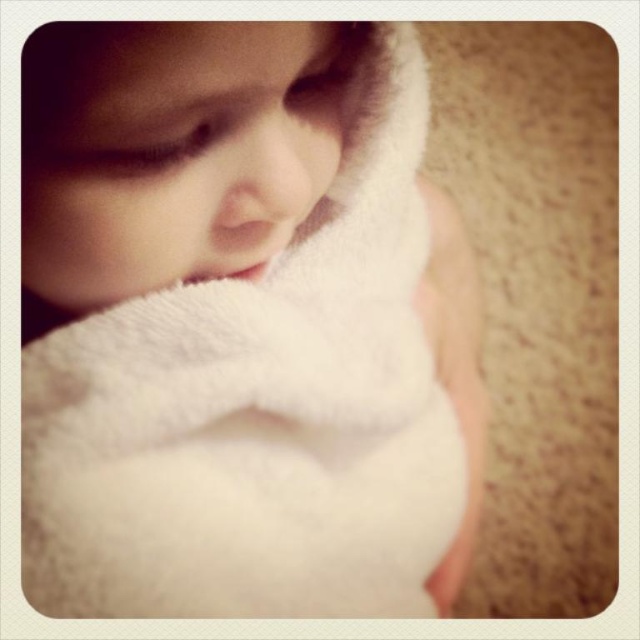
Can you confirm if white fluffy towel at upper left is taller than white fluffy towel at center?

Yes, white fluffy towel at upper left is taller than white fluffy towel at center.

Is point (387, 122) more distant than point (298, 74)?

That is True.

This screenshot has height=640, width=640. Describe the element at coordinates (234, 323) in the screenshot. I see `white fluffy towel at upper left` at that location.

The height and width of the screenshot is (640, 640). Find the location of `white fluffy towel at upper left`. white fluffy towel at upper left is located at coordinates (234, 323).